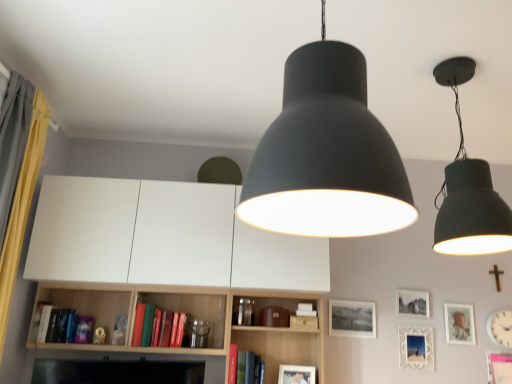
Question: Is matte black lampshade at center, arranged as the first lamp when viewed from the left, far from yellow fabric curtain at left?

Choices:
 (A) no
 (B) yes

Answer: (B)

Question: Considering the relative sizes of matte black lampshade at center, arranged as the first lamp when viewed from the left, and yellow fabric curtain at left in the image provided, is matte black lampshade at center, arranged as the first lamp when viewed from the left, thinner than yellow fabric curtain at left?

Choices:
 (A) yes
 (B) no

Answer: (B)

Question: Considering the relative positions of matte black lampshade at center, which appears as the 2th lamp when viewed from the back, and yellow fabric curtain at left in the image provided, is matte black lampshade at center, which appears as the 2th lamp when viewed from the back, to the left of yellow fabric curtain at left from the viewer's perspective?

Choices:
 (A) no
 (B) yes

Answer: (A)

Question: Is matte black lampshade at center, arranged as the first lamp when viewed from the left, smaller than yellow fabric curtain at left?

Choices:
 (A) no
 (B) yes

Answer: (A)

Question: Is matte black lampshade at center, acting as the 2th lamp starting from the right, turned away from yellow fabric curtain at left?

Choices:
 (A) no
 (B) yes

Answer: (A)

Question: Looking at their shapes, would you say white plastic clock at lower right is wider or thinner than hardcover book at center, the 1th book in the bottom-to-top sequence?

Choices:
 (A) wide
 (B) thin

Answer: (B)

Question: Considering their positions, is white plastic clock at lower right located in front of or behind hardcover book at center, the second book positioned from the left?

Choices:
 (A) front
 (B) behind

Answer: (B)

Question: From a real-world perspective, is white plastic clock at lower right above or below hardcover book at center, the 1th book in the bottom-to-top sequence?

Choices:
 (A) below
 (B) above

Answer: (B)

Question: Is white plastic clock at lower right taller or shorter than hardcover book at center, which is counted as the 2th book, starting from the top?

Choices:
 (A) tall
 (B) short

Answer: (A)

Question: Is hardcover book at center, the 1th book in the right-to-left sequence, wider or thinner than matte black picture frame at center, which appears as the 2th picture frame when viewed from the left?

Choices:
 (A) wide
 (B) thin

Answer: (A)

Question: From their relative heights in the image, would you say hardcover book at center, which is counted as the 2th book, starting from the top, is taller or shorter than matte black picture frame at center, which appears as the 2th picture frame when viewed from the left?

Choices:
 (A) tall
 (B) short

Answer: (A)

Question: From the image's perspective, relative to matte black picture frame at center, positioned as the 4th picture frame in right-to-left order, is hardcover book at center, the 1th book in the bottom-to-top sequence, above or below?

Choices:
 (A) below
 (B) above

Answer: (A)

Question: Do you think hardcover book at center, the second book positioned from the left, is within matte black picture frame at center, which appears as the 2th picture frame when viewed from the left, or outside of it?

Choices:
 (A) outside
 (B) inside

Answer: (A)

Question: From the image's perspective, is matte gold picture frame at upper right, placed as the first picture frame when sorted from right to left, above or below yellow fabric curtain at left?

Choices:
 (A) below
 (B) above

Answer: (A)

Question: Considering their positions, is matte gold picture frame at upper right, placed as the first picture frame when sorted from right to left, located in front of or behind yellow fabric curtain at left?

Choices:
 (A) front
 (B) behind

Answer: (B)